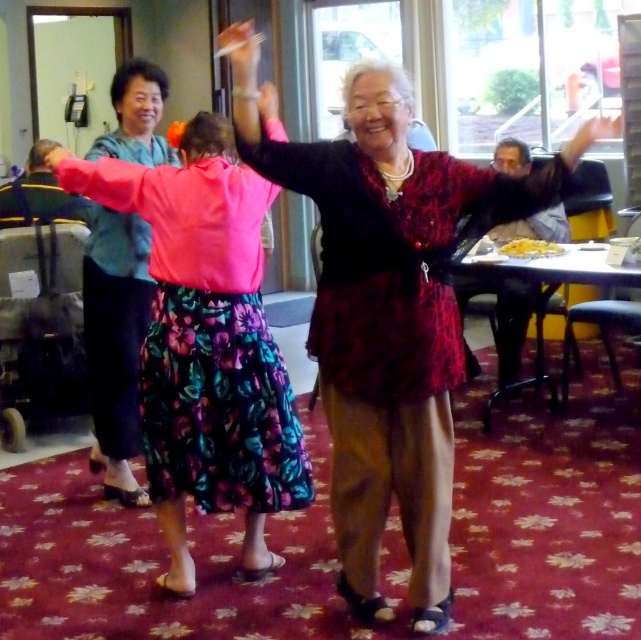
Which is above, floral skirt at center or smooth skin hand at upper right?

smooth skin hand at upper right

Consider the image. Is floral skirt at center in front of smooth skin hand at upper right?

No, it is not.

Is point (88, 227) less distant than point (588, 132)?

That is False.

Locate an element on the screen. floral skirt at center is located at coordinates (115, 342).

Which of these two, floral print fabric skirt at center or pink fabric arm at upper left, stands shorter?

pink fabric arm at upper left is shorter.

Is floral print fabric skirt at center positioned in front of pink fabric arm at upper left?

Yes, it is.

Is point (153, 168) closer to viewer compared to point (115, 198)?

No, (153, 168) is further to viewer.

Where is `floral print fabric skirt at center`? This screenshot has width=641, height=640. floral print fabric skirt at center is located at coordinates (206, 337).

Measure the distance between floral fabric dress at center and pink fabric arm at upper left.

floral fabric dress at center is 91.00 centimeters away from pink fabric arm at upper left.

Is point (337, 184) in front of point (112, 168)?

Yes, it is in front of point (112, 168).

Between point (383, 237) and point (119, 204), which one is positioned behind?

Positioned behind is point (119, 204).

Where is `floral fabric dress at center`? floral fabric dress at center is located at coordinates (394, 257).